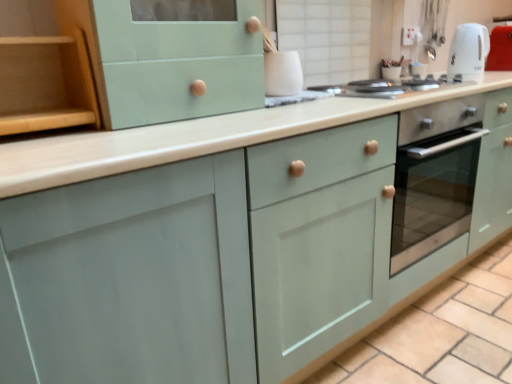
Image resolution: width=512 pixels, height=384 pixels. What are the coordinates of `free spot in front of white glossy kettle at upper center, positioned as the second appliance in back-to-front order` in the screenshot? It's located at (295, 103).